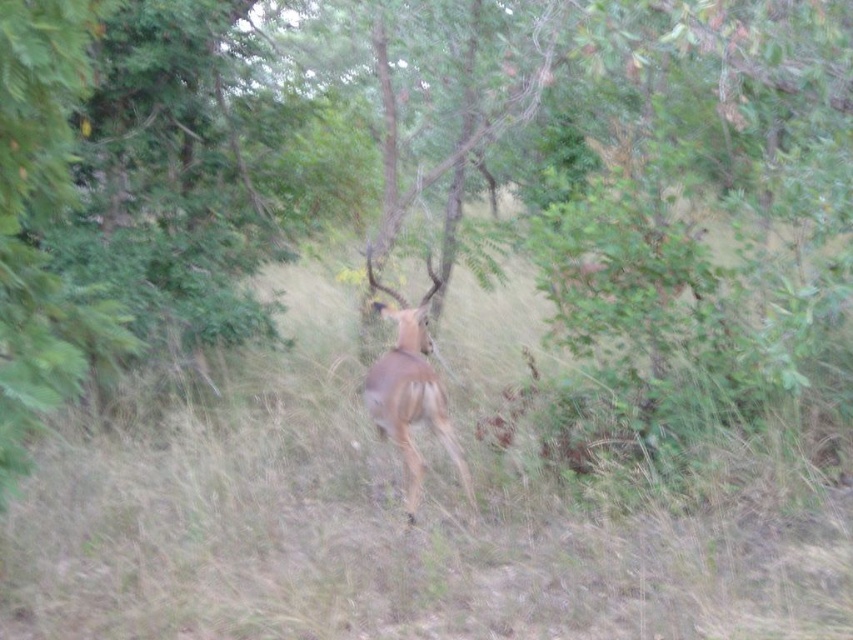
You are a hiker who wants to take a photo of the brown matte antelope at center without stepping on the green grass at center. Which direction should you move to position yourself behind the antelope?

The green grass at center is below the brown matte antelope at center, so you should move behind the antelope in the direction it is facing to avoid stepping on the grass.

You are a photographer trying to capture the brown matte antelope at center while ensuring the green grass at center is visible in the background. Based on their sizes, which object should you focus on to ensure both are in frame?

Since the green grass at center is smaller than the brown matte antelope at center, focusing on the brown matte antelope at center will keep both in frame as the antelope is larger and central.

Looking at this image, you are a photographer trying to capture a clear shot of the brown matte antelope at center. However, there is green grass at center in the way. Can you determine if the grass is blocking the antelope?

The green grass at center might be wider than the brown matte antelope at center, which means the grass could be blocking the antelope from view.